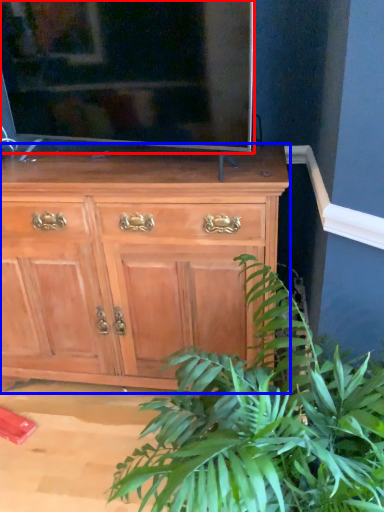
Question: Which object appears closest to the camera in this image, television (highlighted by a red box) or chest of drawers (highlighted by a blue box)?

Choices:
 (A) television
 (B) chest of drawers

Answer: (A)